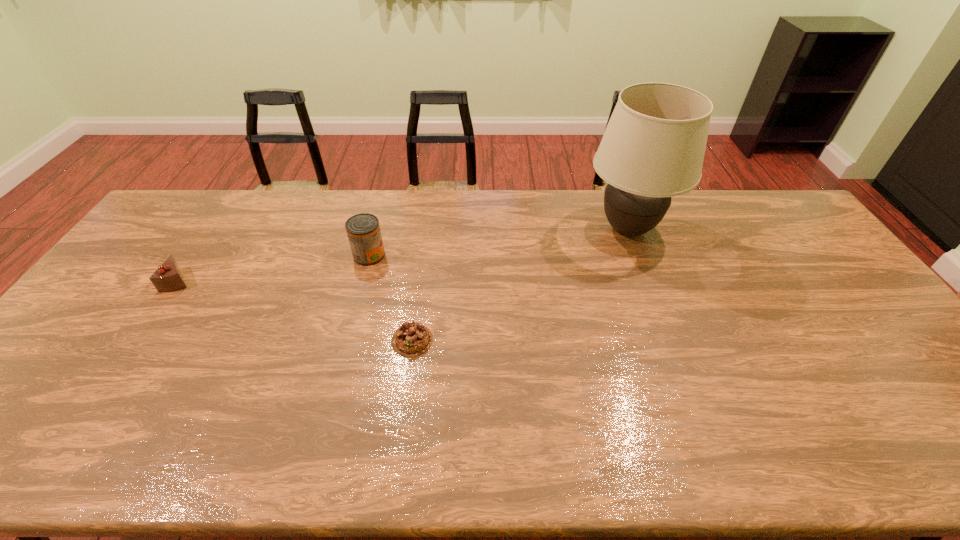
I want to click on the rightmost object, so click(x=653, y=148).

At what (x,y) coordinates should I click in order to perform the action: click on lampshade. Please return your answer as a coordinate pair (x, y). The width and height of the screenshot is (960, 540). Looking at the image, I should click on (653, 148).

I want to click on the third shortest object, so point(363,230).

In order to click on the third object from right to left in this screenshot , I will do `click(363, 230)`.

The width and height of the screenshot is (960, 540). Identify the location of the second nearest object. (168, 277).

At what (x,y) coordinates should I click in order to perform the action: click on the farther chocolate cake. Please return your answer as a coordinate pair (x, y). This screenshot has width=960, height=540. Looking at the image, I should click on (168, 277).

The height and width of the screenshot is (540, 960). What are the coordinates of `the shortest object` in the screenshot? It's located at (412, 339).

Where is `the shorter chocolate cake`? the shorter chocolate cake is located at coordinates (412, 339).

Locate an element on the screen. The height and width of the screenshot is (540, 960). vacant space located 0.380m on the left of the tallest object is located at coordinates [468, 230].

Locate an element on the screen. free spot located 0.240m on the front of the can is located at coordinates (350, 327).